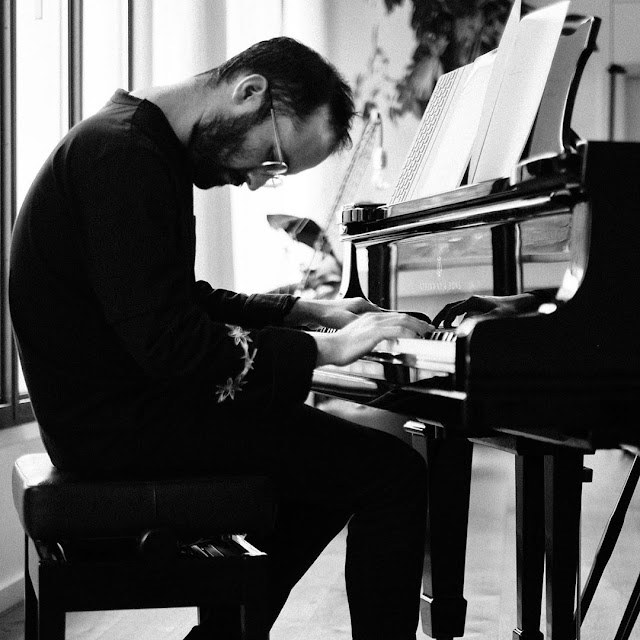
You are a GUI agent. You are given a task and a screenshot of the screen. Output one action in this format:
    pyautogui.click(x=<x>, y=<y>)
    Task: Click on the piano keys
    Image resolution: width=640 pixels, height=640 pixels.
    Given the screenshot: What is the action you would take?
    pyautogui.click(x=451, y=338)